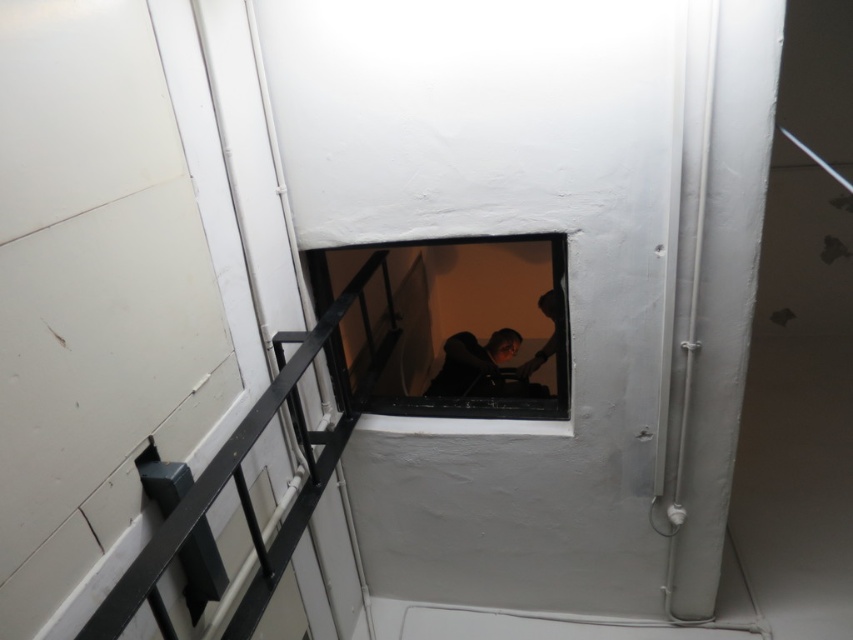
Is dark hair at center thinner than smooth skin person at center?

Incorrect, dark hair at center's width is not less than smooth skin person at center's.

Which of these two, dark hair at center or smooth skin person at center, stands taller?

With more height is smooth skin person at center.

Which is behind, point (480, 374) or point (549, 304)?

Point (480, 374)

The height and width of the screenshot is (640, 853). I want to click on dark hair at center, so click(474, 364).

The height and width of the screenshot is (640, 853). Describe the element at coordinates (456, 324) in the screenshot. I see `transparent glass window at center` at that location.

From the picture: Can you confirm if transparent glass window at center is positioned to the left of smooth skin person at center?

Indeed, transparent glass window at center is positioned on the left side of smooth skin person at center.

Which is behind, point (517, 262) or point (549, 300)?

Point (517, 262)

This screenshot has height=640, width=853. In order to click on transparent glass window at center in this screenshot , I will do `click(456, 324)`.

How much distance is there between transparent glass window at center and dark hair at center?

transparent glass window at center is 12.72 inches from dark hair at center.

Is point (479, 321) positioned in front of point (450, 349)?

No, it is behind (450, 349).

This screenshot has height=640, width=853. Find the location of `transparent glass window at center`. transparent glass window at center is located at coordinates (456, 324).